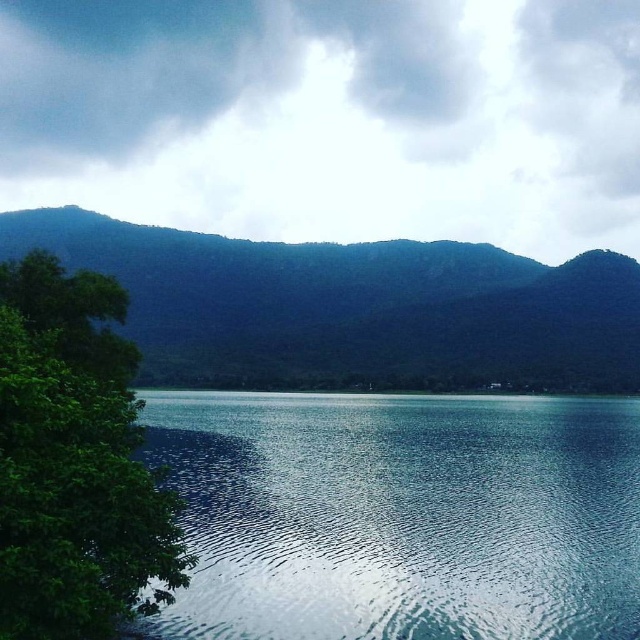
Between point (588, 90) and point (442, 289), which one is positioned behind?

Positioned behind is point (588, 90).

Locate an element on the screen. The height and width of the screenshot is (640, 640). white fluffy cloud at upper center is located at coordinates (330, 116).

Can you confirm if clear water at center is smaller than green forested mountain at center?

Yes, clear water at center is smaller than green forested mountain at center.

Which of these two, clear water at center or green forested mountain at center, stands taller?

Standing taller between the two is green forested mountain at center.

Between point (432, 625) and point (433, 321), which one is positioned in front?

Point (432, 625) is in front.

The image size is (640, 640). In order to click on clear water at center in this screenshot , I will do `click(401, 515)`.

Who is more forward, (467, 116) or (81, 458)?

Point (81, 458) is more forward.

Between white fluffy cloud at upper center and green leafy tree at left, which one appears on the right side from the viewer's perspective?

green leafy tree at left is more to the right.

Who is more distant from viewer, (515, 17) or (108, 397)?

The point (515, 17) is behind.

Locate an element on the screen. white fluffy cloud at upper center is located at coordinates (330, 116).